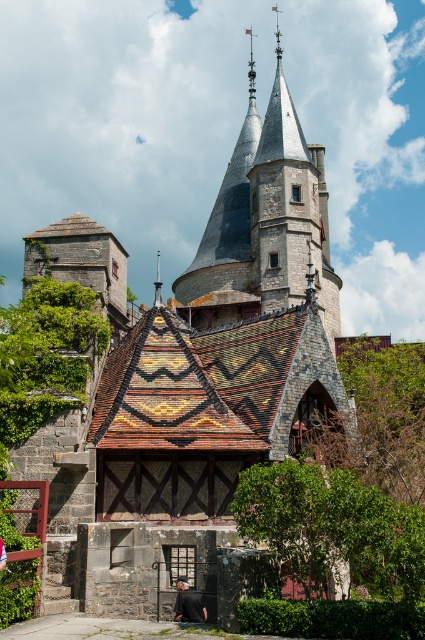
In the scene shown: Is smooth gray stone spire at upper center shorter than black leather jacket at lower center?

Incorrect, smooth gray stone spire at upper center's height does not fall short of black leather jacket at lower center's.

Between smooth gray stone spire at upper center and black leather jacket at lower center, which one appears on the right side from the viewer's perspective?

Positioned to the right is smooth gray stone spire at upper center.

Does point (252, 81) lie behind point (2, 544)?

That is True.

Find the location of a particular element. The image size is (425, 640). smooth gray stone spire at upper center is located at coordinates (266, 218).

The height and width of the screenshot is (640, 425). Identify the location of smooth gray stone spire at upper center. (266, 218).

Is smooth gray stone spire at upper center bigger than dark blue fabric at center?

Indeed, smooth gray stone spire at upper center has a larger size compared to dark blue fabric at center.

Where is `smooth gray stone spire at upper center`? The height and width of the screenshot is (640, 425). smooth gray stone spire at upper center is located at coordinates (266, 218).

Which is more to the left, dark blue fabric at center or black leather jacket at lower center?

black leather jacket at lower center

Can you confirm if dark blue fabric at center is thinner than black leather jacket at lower center?

No, dark blue fabric at center is not thinner than black leather jacket at lower center.

Does point (176, 604) lie behind point (2, 544)?

Yes.

Locate an element on the screen. dark blue fabric at center is located at coordinates (187, 602).